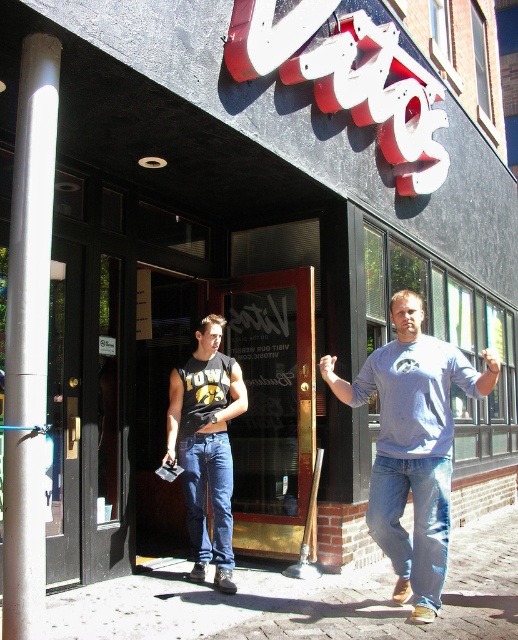
How distant is light blue cotton t-shirt at center from light blue denim jeans at lower right?

light blue cotton t-shirt at center and light blue denim jeans at lower right are 4.61 inches apart.

Is light blue cotton t-shirt at center above light blue denim jeans at lower right?

Correct, light blue cotton t-shirt at center is located above light blue denim jeans at lower right.

Identify the location of light blue cotton t-shirt at center. The image size is (518, 640). (412, 445).

Is brick pavement at lower center taller than matte black tank top at center?

Incorrect, brick pavement at lower center's height is not larger of matte black tank top at center's.

The image size is (518, 640). Describe the element at coordinates (304, 600) in the screenshot. I see `brick pavement at lower center` at that location.

Who is more forward, (75, 595) or (219, 440)?

Point (75, 595)

The image size is (518, 640). I want to click on brick pavement at lower center, so click(x=304, y=600).

Is point (410, 360) positioned before point (193, 451)?

Yes, it is.

Is light blue cotton t-shirt at center smaller than denim jeans at center?

No.

Is point (384, 484) farther from viewer compared to point (192, 438)?

No, (384, 484) is closer to viewer.

Where is `light blue cotton t-shirt at center`? light blue cotton t-shirt at center is located at coordinates (412, 445).